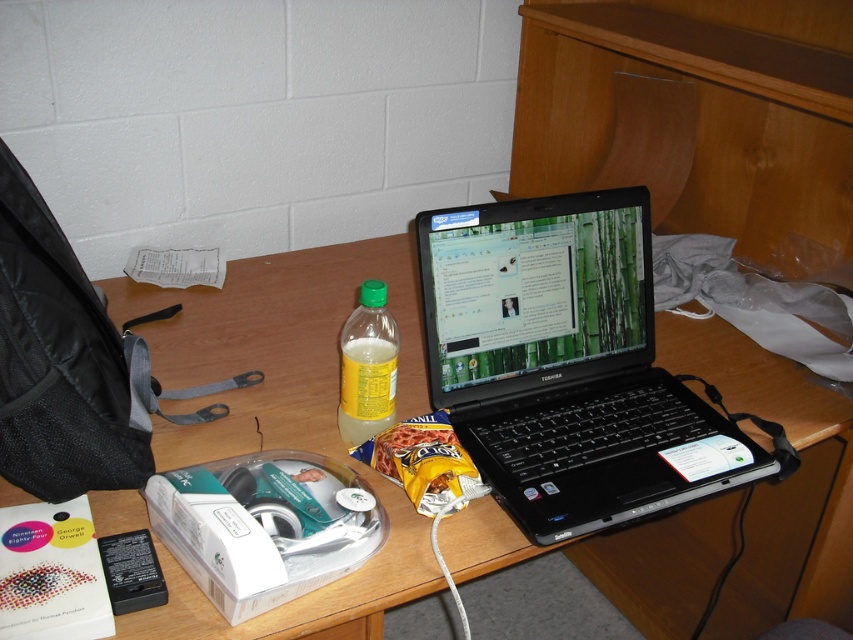
You are organizing the desk and want to place the black plastic laptop at center to the left of the translucent plastic bottle at center. Is the current arrangement already meeting this requirement?

The black plastic laptop at center is currently to the right of the translucent plastic bottle at center, so it does not meet the requirement of placing it to the left. You will need to move the laptop to the left side of the bottle.

What is the exact coordinate of the wooden at center?

The wooden at center is located at point (283, 416).